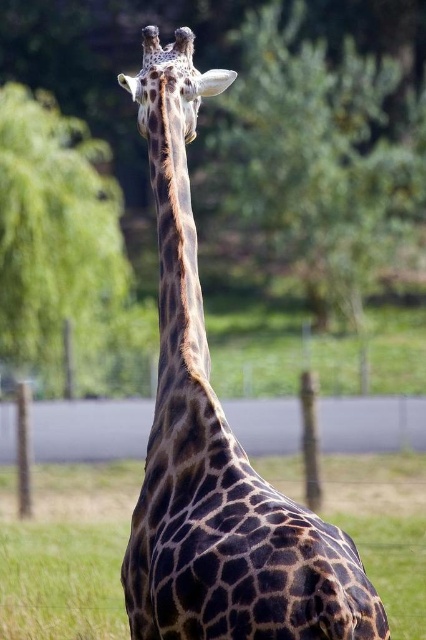
You are standing in front of the giraffe in the image. Looking at the green leafy tree at upper left, can you tell me its exact coordinates in the image?

The green leafy tree at upper left is located at coordinates point [54,236].

You are a photographer standing at the camera position. You want to take a photo of the giraffe and include the green leafy tree at upper left in the frame. Given that the tree is 19.56 meters away from you, is it possible to capture both the giraffe and the tree in the same photo without moving the camera?

The green leafy tree at upper left is 19.56 meters from the camera. Since the giraffe is in the foreground and the tree is in the background, they are both within the same line of sight. Therefore, it is possible to capture both the giraffe and the tree in the same photo without moving the camera.